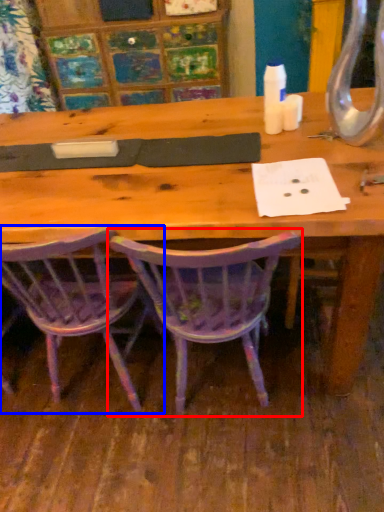
Question: Which of the following is the farthest to the observer, chair (highlighted by a red box) or chair (highlighted by a blue box)?

Choices:
 (A) chair
 (B) chair

Answer: (B)